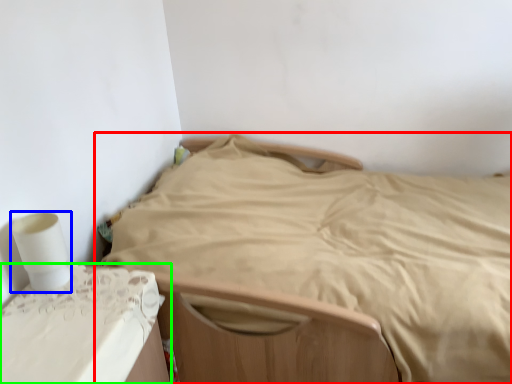
Question: Estimate the real-world distances between objects in this image. Which object is closer to bed (highlighted by a red box), toilet paper (highlighted by a blue box) or furniture (highlighted by a green box)?

Choices:
 (A) toilet paper
 (B) furniture

Answer: (B)